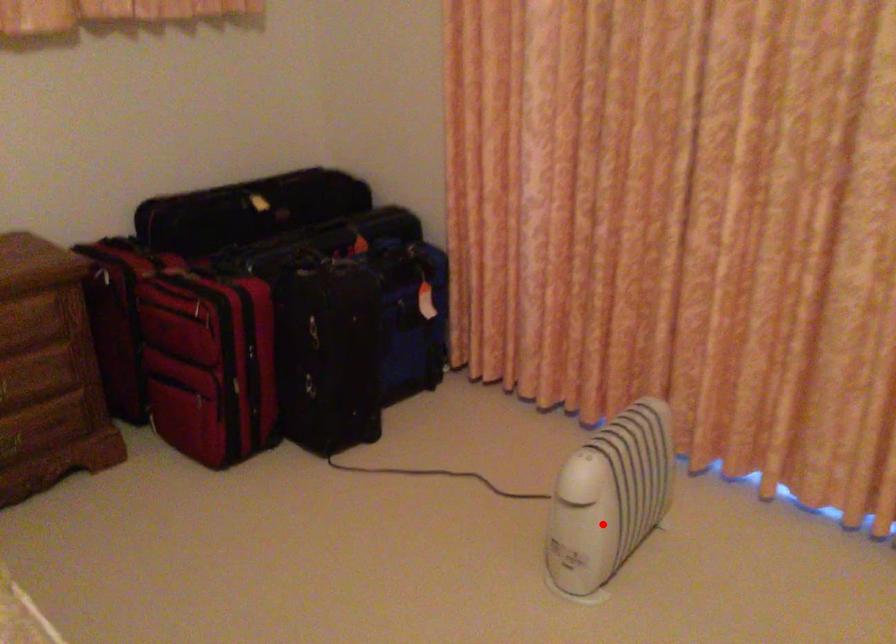
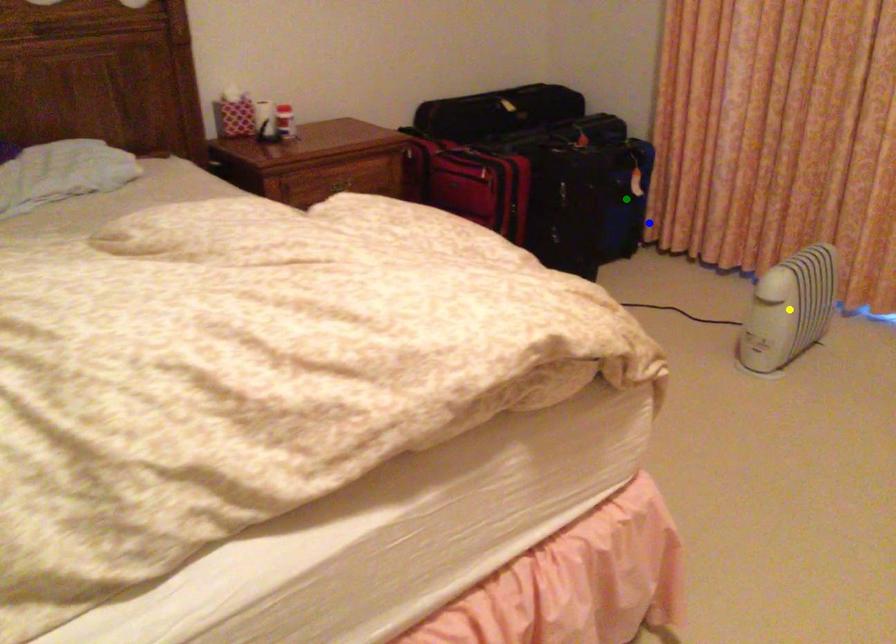
Question: I am providing you with two images of the same scene from different viewpoints. A red point is marked on the first image. You are given multiple points on the second image. Which point in image 2 represents the same 3d spot as the red point in image 1?

Choices:
 (A) blue point
 (B) yellow point
 (C) green point

Answer: (B)